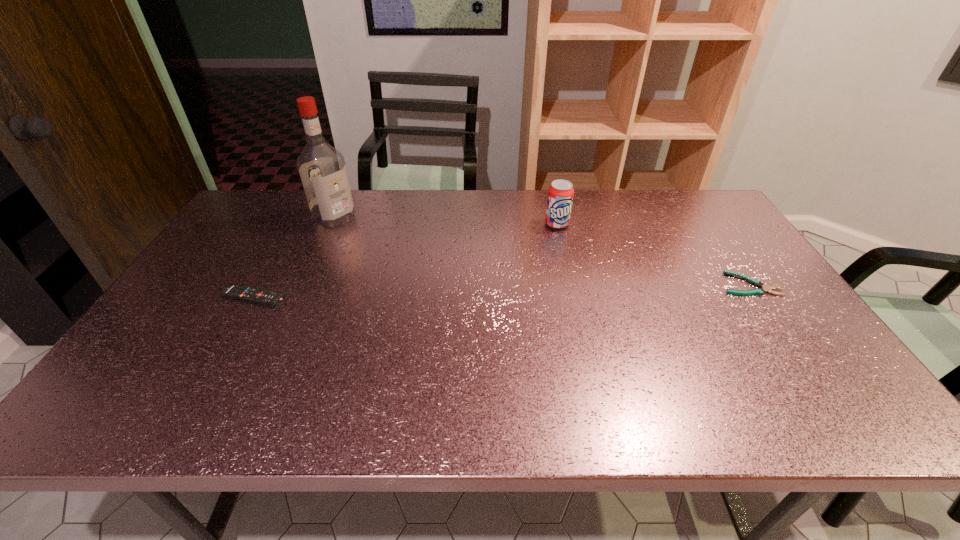
Where is `free space on the desktop that is between the second shortest object and the shortest object and is positioned on the surface of the third shortest object`? The height and width of the screenshot is (540, 960). free space on the desktop that is between the second shortest object and the shortest object and is positioned on the surface of the third shortest object is located at coordinates (571, 289).

The width and height of the screenshot is (960, 540). I want to click on vacant space on the desktop that is between the third tallest object and the pliers and is positioned on the front-facing side of the liquor, so click(x=446, y=292).